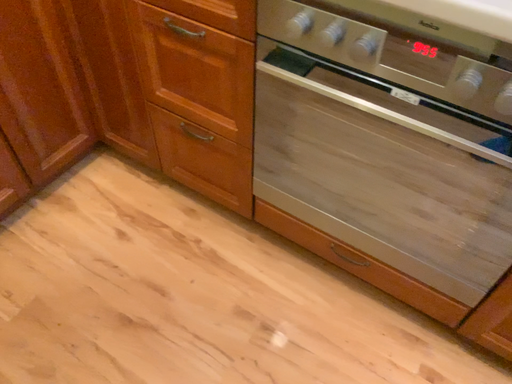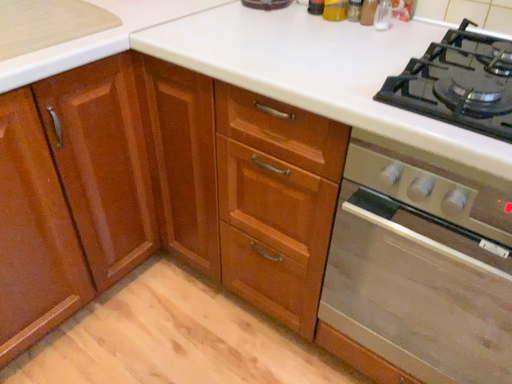
Question: How did the camera likely rotate when shooting the video?

Choices:
 (A) rotated downward
 (B) rotated upward

Answer: (B)